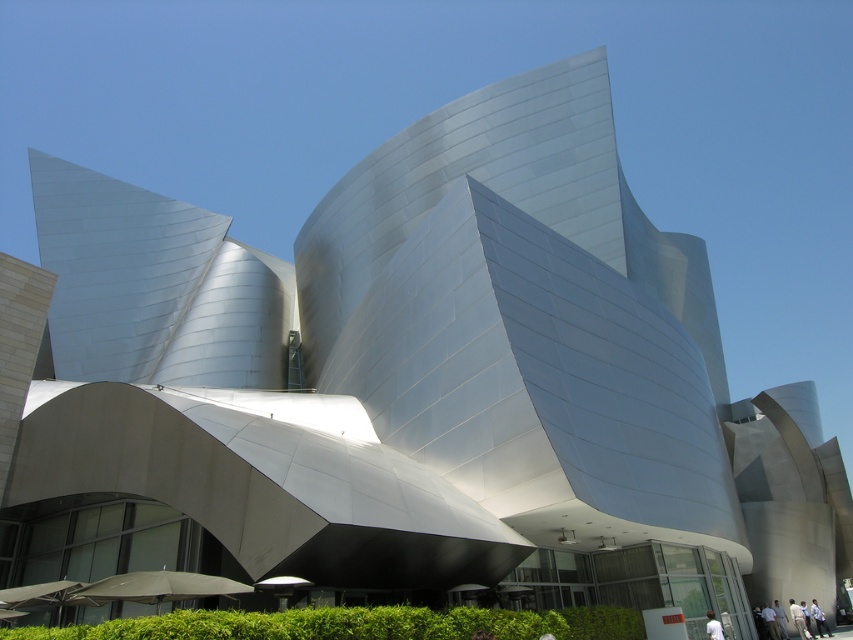
Is white matte person at lower right thinner than light blue shirt at lower right?

Correct, white matte person at lower right's width is less than light blue shirt at lower right's.

What do you see at coordinates (798, 620) in the screenshot?
I see `white matte person at lower right` at bounding box center [798, 620].

Where is `white matte person at lower right`? white matte person at lower right is located at coordinates (798, 620).

What do you see at coordinates (798, 620) in the screenshot? The image size is (853, 640). I see `white matte person at lower right` at bounding box center [798, 620].

Where is `white matte person at lower right`? This screenshot has height=640, width=853. white matte person at lower right is located at coordinates (798, 620).

Describe the element at coordinates (798, 620) in the screenshot. I see `white matte person at lower right` at that location.

Where is `white matte person at lower right`? The image size is (853, 640). white matte person at lower right is located at coordinates (798, 620).

Measure the distance between light blue shirt at lower right and white matte shirt at lower right.

light blue shirt at lower right is 60.37 feet away from white matte shirt at lower right.

Who is more distant from viewer, (811, 605) or (711, 630)?

The point (811, 605) is behind.

At what (x,y) coordinates should I click in order to perform the action: click on light blue shirt at lower right. Please return your answer as a coordinate pair (x, y). This screenshot has height=640, width=853. Looking at the image, I should click on (817, 618).